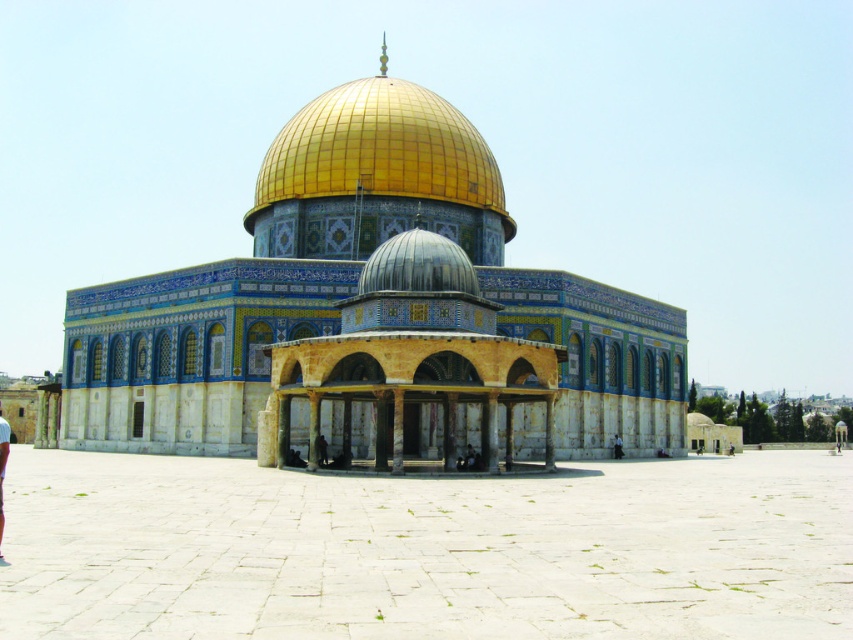
You are an architect analyzing the Dome of the Rock. You observe the golden mosaic dome at center and the gold metallic dome at upper center. Which of these two domes has a larger size?

The golden mosaic dome at center is bigger than the gold metallic dome at upper center, so the golden mosaic dome at center has a larger size.

Consider the image. You are an architect analyzing the Dome of the Rock. You notice the gold metallic dome at upper center and the light blue fabric pants at lower left in the image. Which object appears smaller in the scene?

The gold metallic dome at upper center appears smaller compared to the light blue fabric pants at lower left.